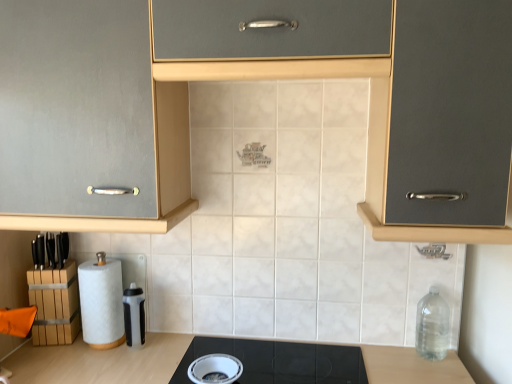
Identify the location of vacant space situated above black glass cooktop at center (from a real-world perspective). This screenshot has width=512, height=384. (269, 360).